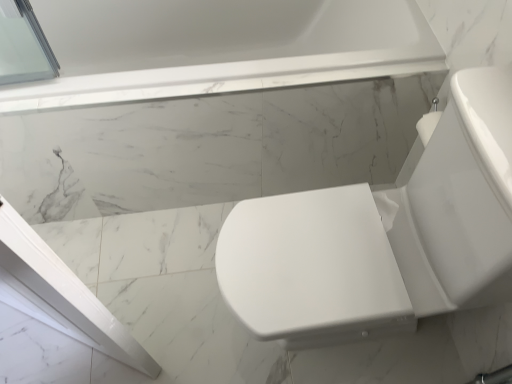
This screenshot has width=512, height=384. In order to click on white glossy toilet at right in this screenshot , I will do `click(383, 236)`.

What do you see at coordinates (383, 236) in the screenshot? The height and width of the screenshot is (384, 512). I see `white glossy toilet at right` at bounding box center [383, 236].

This screenshot has height=384, width=512. What do you see at coordinates (220, 47) in the screenshot? I see `white marble bathtub at upper center` at bounding box center [220, 47].

This screenshot has height=384, width=512. Identify the location of white marble bathtub at upper center. (220, 47).

Locate an element on the screen. The width and height of the screenshot is (512, 384). white glossy toilet at right is located at coordinates (383, 236).

In the scene shown: Can you confirm if white marble bathtub at upper center is positioned to the left of white glossy toilet at right?

Yes.

Relative to white glossy toilet at right, is white marble bathtub at upper center in front or behind?

white marble bathtub at upper center is behind white glossy toilet at right.

Does point (408, 49) lie in front of point (303, 203)?

No, it is not.

Consider the image. From the image's perspective, which is above, white marble bathtub at upper center or white glossy toilet at right?

white marble bathtub at upper center.

From a real-world perspective, who is located lower, white marble bathtub at upper center or white glossy toilet at right?

white marble bathtub at upper center, from a real-world perspective.

Which object is wider, white marble bathtub at upper center or white glossy toilet at right?

With larger width is white glossy toilet at right.

Is white marble bathtub at upper center taller or shorter than white glossy toilet at right?

In the image, white marble bathtub at upper center appears to be shorter than white glossy toilet at right.

Considering the relative sizes of white marble bathtub at upper center and white glossy toilet at right in the image provided, is white marble bathtub at upper center smaller than white glossy toilet at right?

No, white marble bathtub at upper center is not smaller than white glossy toilet at right.

Is white marble bathtub at upper center not inside white glossy toilet at right?

Yes, white marble bathtub at upper center is outside of white glossy toilet at right.

Can you see white marble bathtub at upper center touching white glossy toilet at right?

No.

Is white marble bathtub at upper center oriented away from white glossy toilet at right?

No, white marble bathtub at upper center is not facing away from white glossy toilet at right.

From the picture: How much distance is there between white marble bathtub at upper center and white glossy toilet at right?

white marble bathtub at upper center is 57.26 centimeters away from white glossy toilet at right.

Image resolution: width=512 pixels, height=384 pixels. In order to click on bathtub that is under the white glossy toilet at right (from a real-world perspective) in this screenshot , I will do `click(220, 47)`.

Considering the relative positions of white glossy toilet at right and white marble bathtub at upper center in the image provided, is white glossy toilet at right to the left or to the right of white marble bathtub at upper center?

Clearly, white glossy toilet at right is on the right of white marble bathtub at upper center in the image.

Which object is further away from the camera taking this photo, white glossy toilet at right or white marble bathtub at upper center?

Positioned behind is white marble bathtub at upper center.

Does point (485, 228) come closer to viewer compared to point (405, 5)?

Yes, it is.

From the image's perspective, does white glossy toilet at right appear lower than white marble bathtub at upper center?

Yes.

From a real-world perspective, between white glossy toilet at right and white marble bathtub at upper center, who is vertically higher?

white glossy toilet at right is physically above.

Based on the photo, considering the relative sizes of white glossy toilet at right and white marble bathtub at upper center in the image provided, is white glossy toilet at right thinner than white marble bathtub at upper center?

Incorrect, the width of white glossy toilet at right is not less than that of white marble bathtub at upper center.

Does white glossy toilet at right have a lesser height compared to white marble bathtub at upper center?

No, white glossy toilet at right is not shorter than white marble bathtub at upper center.

Can you confirm if white glossy toilet at right is smaller than white marble bathtub at upper center?

Yes.

Is white marble bathtub at upper center completely or partially inside white glossy toilet at right?

No, white marble bathtub at upper center is not inside white glossy toilet at right.

Are white glossy toilet at right and white marble bathtub at upper center making contact?

There is a gap between white glossy toilet at right and white marble bathtub at upper center.

Is white marble bathtub at upper center at the back of white glossy toilet at right?

That's not correct — white glossy toilet at right is not looking away from white marble bathtub at upper center.

How different are the orientations of white glossy toilet at right and white marble bathtub at upper center in degrees?

The angular difference between white glossy toilet at right and white marble bathtub at upper center is 90.1 degrees.

This screenshot has width=512, height=384. Find the location of `bathtub located above the white glossy toilet at right (from the image's perspective)`. bathtub located above the white glossy toilet at right (from the image's perspective) is located at coordinates (220, 47).

Locate an element on the screen. The image size is (512, 384). toilet that is above the white marble bathtub at upper center (from a real-world perspective) is located at coordinates (383, 236).

Find the location of a particular element. toilet lying on the right of white marble bathtub at upper center is located at coordinates (383, 236).